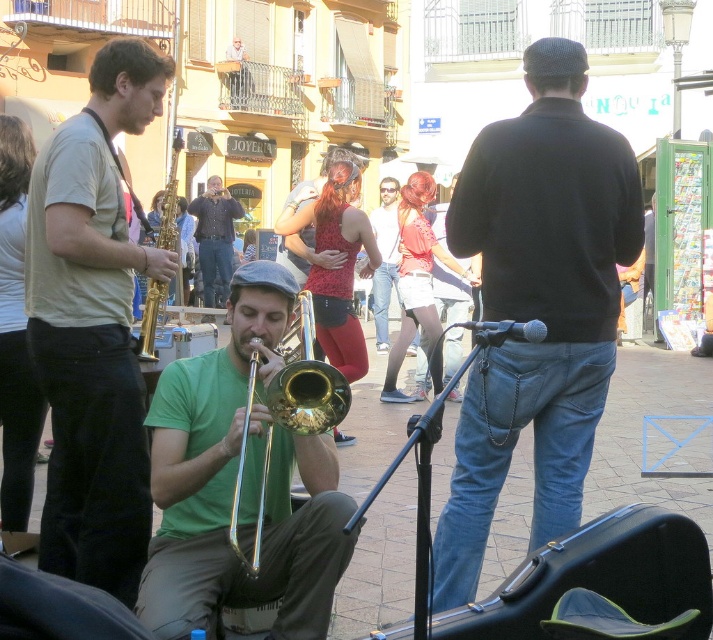
Question: Which point appears farthest from the camera in this image?

Choices:
 (A) (145, 339)
 (B) (339, 396)
 (C) (153, 451)
 (D) (376, 292)

Answer: (D)

Question: Which object is closer to the camera taking this photo?

Choices:
 (A) green matte trombone at center
 (B) gold shiny trumpet at center
 (C) gold brass trumpet at left

Answer: (A)

Question: Does black matte sweater at center come behind green matte trombone at center?

Choices:
 (A) no
 (B) yes

Answer: (B)

Question: Which object is the farthest from the matte red shirt at center?

Choices:
 (A) gold shiny trumpet at center
 (B) denim jacket at center

Answer: (A)

Question: Can you confirm if black matte sweater at center is positioned below matte red shirt at center?

Choices:
 (A) no
 (B) yes

Answer: (B)

Question: Does green matte trombone at center have a lesser width compared to gold brass trumpet at left?

Choices:
 (A) yes
 (B) no

Answer: (A)